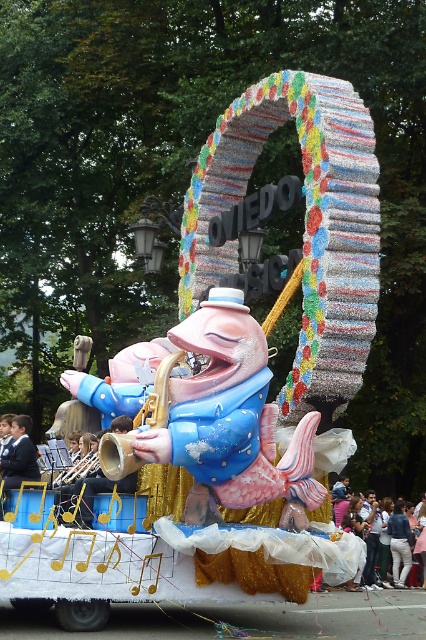
You are a parade attendee standing in front of the float. You need to decide whether to place a small decoration on the light blue fabric at lower right or the denim jacket at lower right. Which surface has a larger area to place the decoration?

The light blue fabric at lower right might be wider than denim jacket at lower right, so it could provide a larger surface area for placing the decoration.